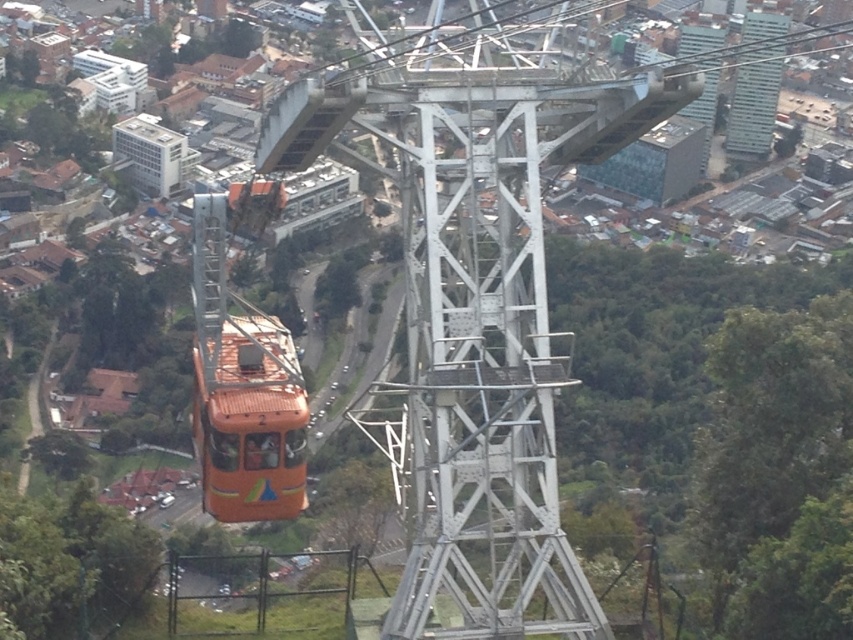
Question: Can you confirm if metallic glass skyscraper at upper right is positioned to the left of white matte building at upper left?

Choices:
 (A) yes
 (B) no

Answer: (B)

Question: Among these objects, which one is nearest to the camera?

Choices:
 (A) metallic glass skyscraper at upper right
 (B) white matte building at upper left

Answer: (A)

Question: Does metallic glass skyscraper at upper right appear on the right side of metallic silver tower at upper right?

Choices:
 (A) yes
 (B) no

Answer: (A)

Question: Which object appears farthest from the camera in this image?

Choices:
 (A) metallic glass skyscraper at upper right
 (B) white matte building at upper left
 (C) metallic silver tower at upper right

Answer: (B)

Question: Does metallic glass skyscraper at upper right appear on the right side of metallic silver tower at upper right?

Choices:
 (A) yes
 (B) no

Answer: (A)

Question: Estimate the real-world distances between objects in this image. Which object is farther from the metallic glass skyscraper at upper right?

Choices:
 (A) metallic silver tower at upper right
 (B) white matte building at upper left

Answer: (B)